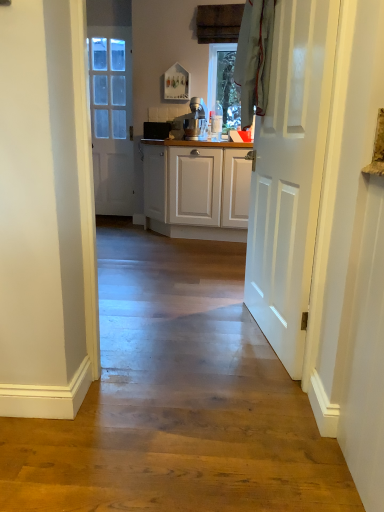
Question: Considering the relative sizes of satin silver mixer at center, the second appliance positioned from the left, and white glossy door at left, the 1th door when ordered from left to right, in the image provided, is satin silver mixer at center, the second appliance positioned from the left, shorter than white glossy door at left, the 1th door when ordered from left to right,?

Choices:
 (A) yes
 (B) no

Answer: (A)

Question: Can you confirm if satin silver mixer at center, the second appliance positioned from the left, is smaller than white glossy door at left, the 1th door when ordered from left to right?

Choices:
 (A) no
 (B) yes

Answer: (B)

Question: From the image's perspective, is satin silver mixer at center, which ranks as the first appliance in right-to-left order, on white glossy door at left, the 1th door when ordered from left to right?

Choices:
 (A) no
 (B) yes

Answer: (A)

Question: Can you confirm if satin silver mixer at center, which ranks as the first appliance in right-to-left order, is bigger than white glossy door at left, the second door viewed from the front?

Choices:
 (A) yes
 (B) no

Answer: (B)

Question: From a real-world perspective, is satin silver mixer at center, which is the first appliance from front to back, over white glossy door at left, the 1th door when ordered from left to right?

Choices:
 (A) no
 (B) yes

Answer: (B)

Question: Is matte black toaster at center, placed as the 2th appliance when sorted from right to left, situated inside white glossy door at left, positioned as the second door in right-to-left order, or outside?

Choices:
 (A) inside
 (B) outside

Answer: (B)

Question: From a real-world perspective, is matte black toaster at center, marked as the first appliance in a left-to-right arrangement, above or below white glossy door at left, the second door viewed from the front?

Choices:
 (A) below
 (B) above

Answer: (A)

Question: Considering the positions of point (152, 122) and point (112, 123), is point (152, 122) closer or farther from the camera than point (112, 123)?

Choices:
 (A) closer
 (B) farther

Answer: (A)

Question: From the image's perspective, relative to white glossy door at left, positioned as the second door in right-to-left order, is matte black toaster at center, placed as the 2th appliance when sorted from right to left, above or below?

Choices:
 (A) above
 (B) below

Answer: (B)

Question: From the image's perspective, is white glossy door at left, the second door viewed from the front, located above or below satin silver mixer at center, the 2th appliance from the back?

Choices:
 (A) above
 (B) below

Answer: (A)

Question: Is white glossy door at left, the 1th door viewed from the back, bigger or smaller than satin silver mixer at center, which is the first appliance from front to back?

Choices:
 (A) small
 (B) big

Answer: (B)

Question: Relative to satin silver mixer at center, the 2th appliance from the back, is white glossy door at left, the 1th door viewed from the back, in front or behind?

Choices:
 (A) front
 (B) behind

Answer: (B)

Question: Is white glossy door at left, positioned as the second door in right-to-left order, to the left or to the right of satin silver mixer at center, the second appliance positioned from the left, in the image?

Choices:
 (A) right
 (B) left

Answer: (B)

Question: From the image's perspective, is satin silver mixer at center, which ranks as the first appliance in right-to-left order, located above or below white glossy door at center, acting as the 2th door starting from the back?

Choices:
 (A) below
 (B) above

Answer: (B)

Question: Choose the correct answer: Is satin silver mixer at center, which is the first appliance from front to back, inside white glossy door at center, which is the 2th door in left-to-right order, or outside it?

Choices:
 (A) inside
 (B) outside

Answer: (B)